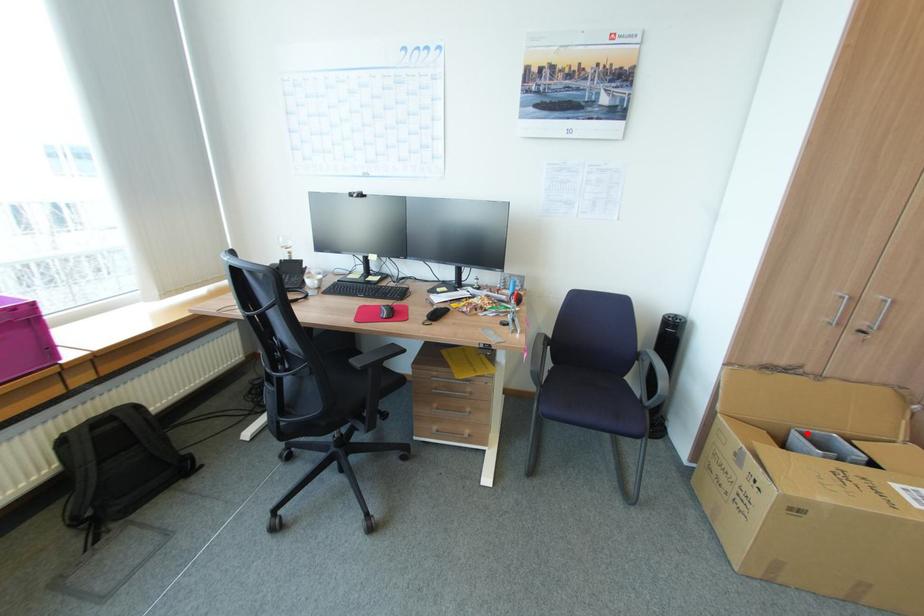
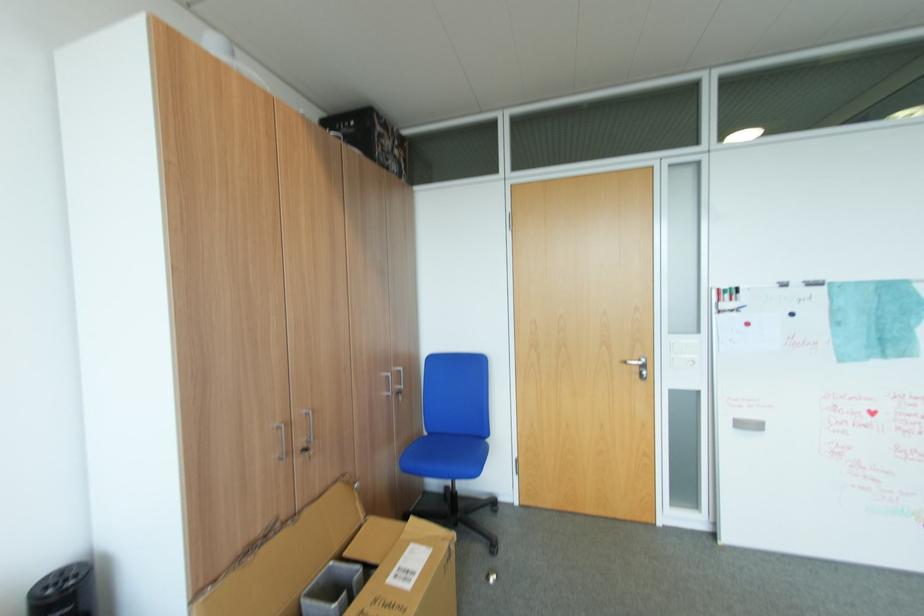
In the second image, find the point that corresponds to the highlighted location in the first image.

(317, 593)